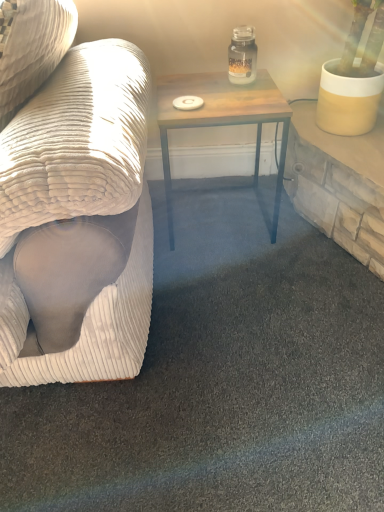
Where is `vacant space positioned to the left of clear glass jar at upper center`? This screenshot has height=512, width=384. vacant space positioned to the left of clear glass jar at upper center is located at coordinates (203, 89).